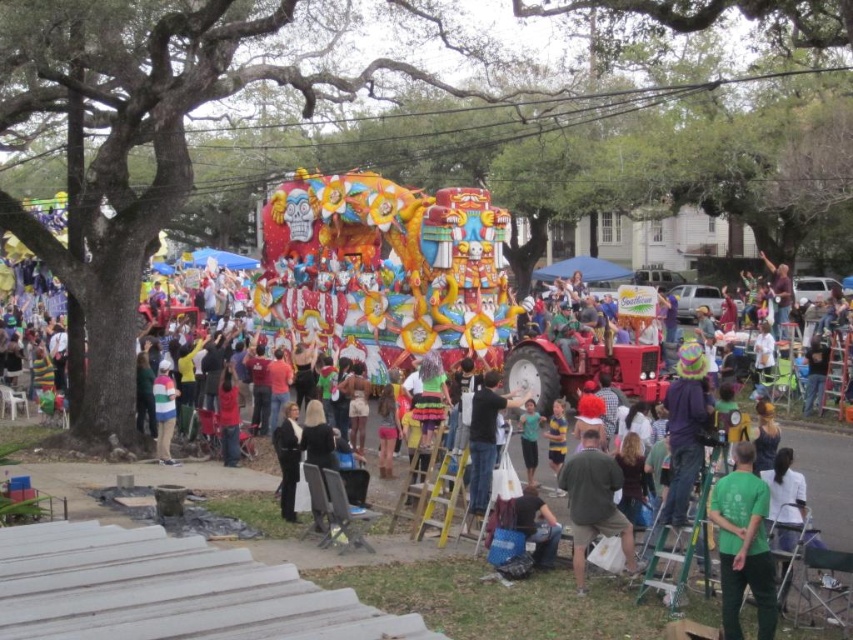
Does green cotton shirt at center come in front of striped sweater at center?

Yes, it is in front of striped sweater at center.

Is green cotton shirt at center bigger than striped sweater at center?

No.

Where is `green cotton shirt at center`? This screenshot has width=853, height=640. green cotton shirt at center is located at coordinates (743, 545).

Does dark blue jeans at center have a greater height compared to black leather pants at lower center?

Yes.

The height and width of the screenshot is (640, 853). I want to click on dark blue jeans at center, so click(x=485, y=438).

Can you confirm if green cotton shirt at center is taller than green fabric shirt at lower center?

Correct, green cotton shirt at center is much taller as green fabric shirt at lower center.

In the scene shown: Can you confirm if green cotton shirt at center is positioned to the left of green fabric shirt at lower center?

No, green cotton shirt at center is not to the left of green fabric shirt at lower center.

The image size is (853, 640). In order to click on green cotton shirt at center in this screenshot , I will do `click(743, 545)`.

You are a GUI agent. You are given a task and a screenshot of the screen. Output one action in this format:
    pyautogui.click(x=<x>, y=<y>)
    Task: Click on the green cotton shirt at center
    
    Given the screenshot: What is the action you would take?
    pyautogui.click(x=743, y=545)